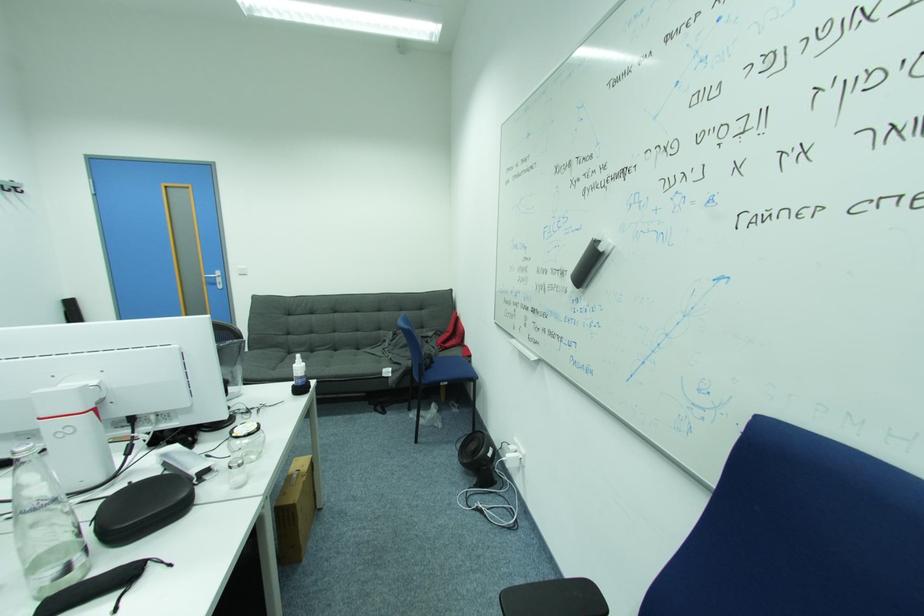
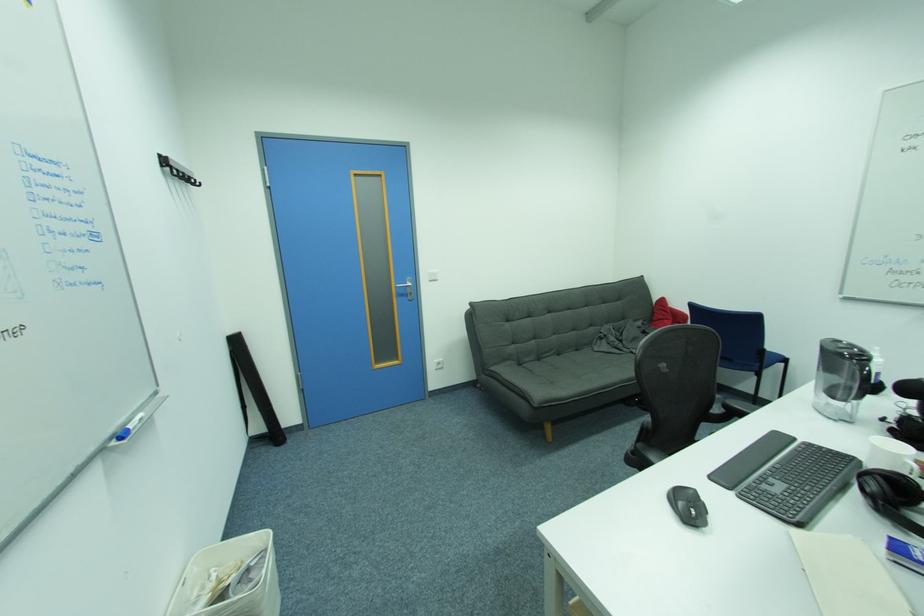
Question: Which direction would the cameraman need to move to produce the second image? Reply with the corresponding letter.

Choices:
 (A) Left
 (B) Right
 (C) Forward
 (D) Backward

Answer: (A)